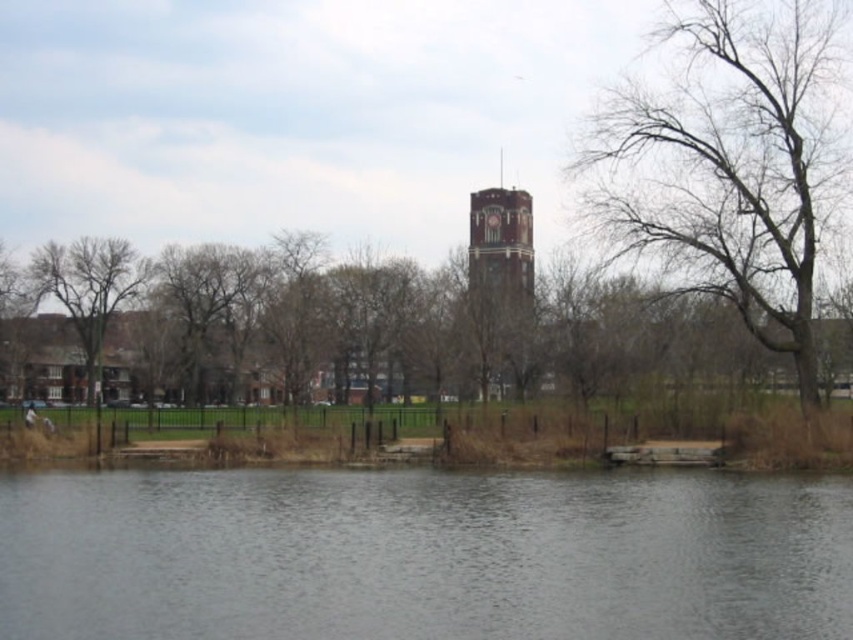
Question: Which of the following is the closest to the observer?

Choices:
 (A) (593, 627)
 (B) (645, 92)

Answer: (A)

Question: Does gray water at lower center lie in front of bare branches at right?

Choices:
 (A) no
 (B) yes

Answer: (B)

Question: Can you confirm if gray water at lower center is thinner than bare branches at right?

Choices:
 (A) no
 (B) yes

Answer: (A)

Question: Which point is farther from the camera taking this photo?

Choices:
 (A) (819, 161)
 (B) (54, 548)

Answer: (A)

Question: Is gray water at lower center bigger than bare branches at right?

Choices:
 (A) yes
 (B) no

Answer: (B)